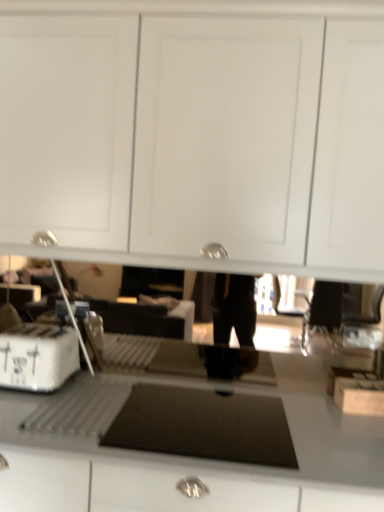
Image resolution: width=384 pixels, height=512 pixels. I want to click on empty space that is ontop of smooth gray countertop at center, so click(201, 417).